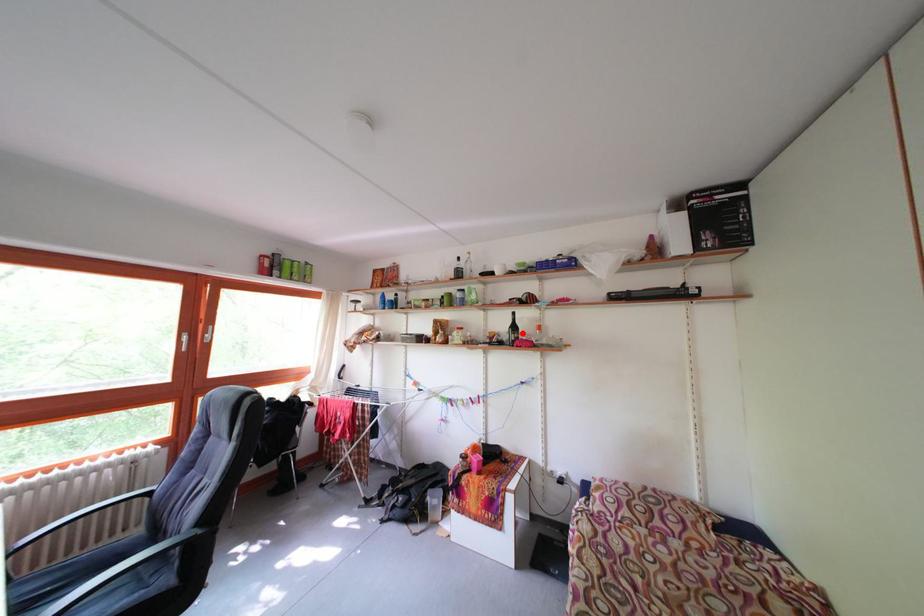
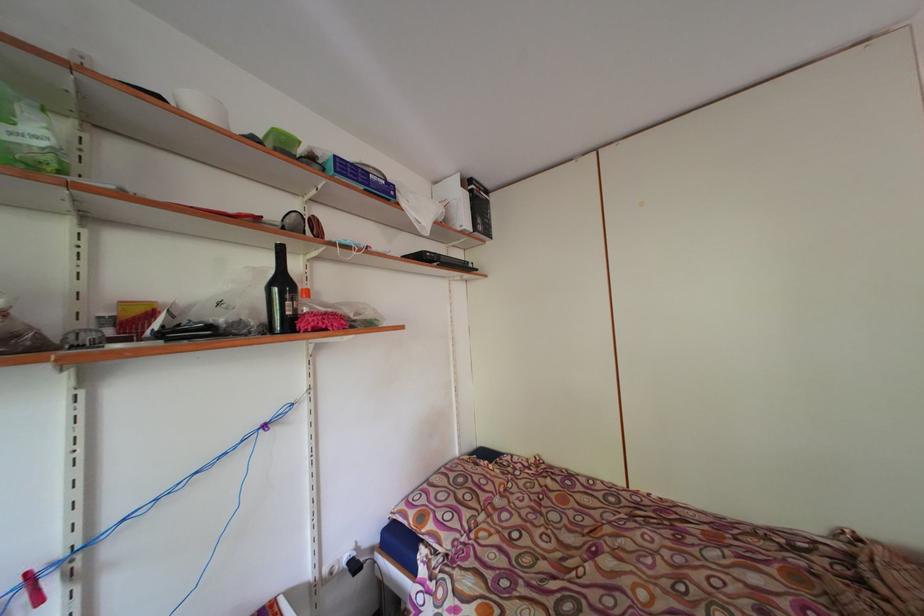
The point at the highlighted location is marked in the first image. Where is the corresponding point in the second image?

(290, 289)